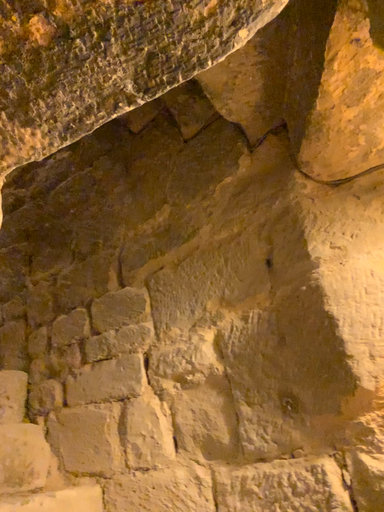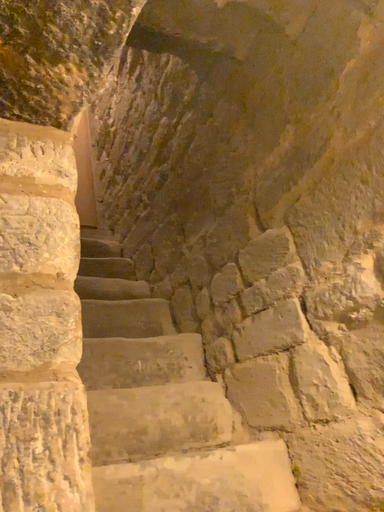
Question: Which way did the camera rotate in the video?

Choices:
 (A) rotated left
 (B) rotated right

Answer: (A)